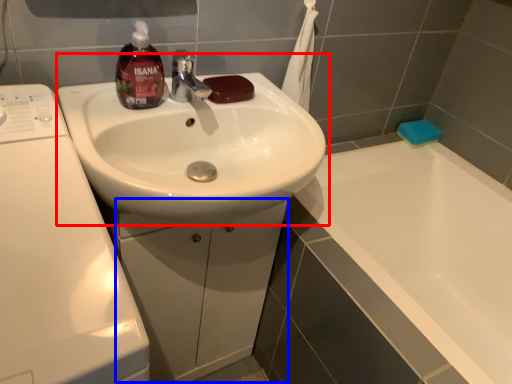
Question: Which object appears farthest to the camera in this image, sink (highlighted by a red box) or drawer (highlighted by a blue box)?

Choices:
 (A) sink
 (B) drawer

Answer: (B)